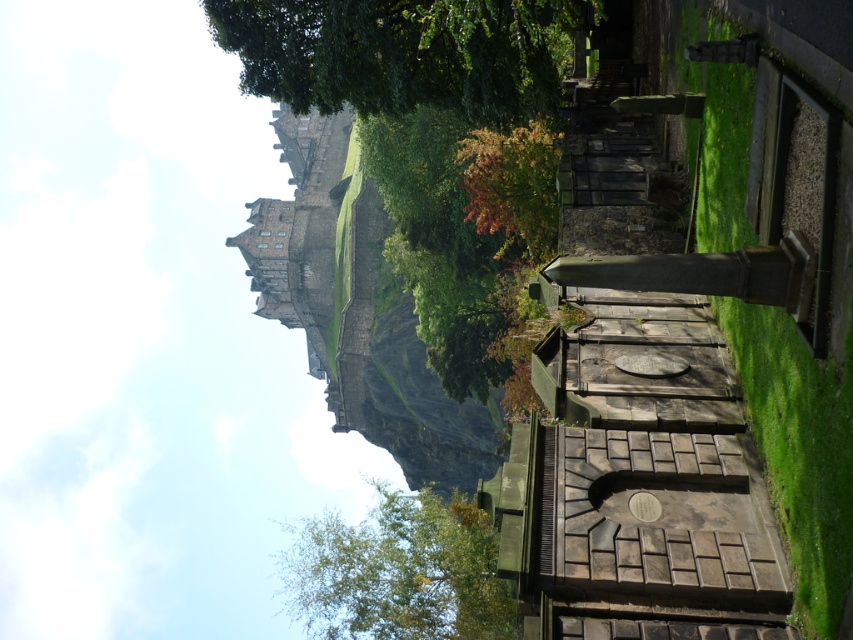
You are standing in the graveyard looking towards Edinburgh Castle. You notice two green leafy trees in the scene. Which tree, the green leafy tree at upper center or the green leafy tree at center, appears closer to you?

The green leafy tree at upper center is in front of the green leafy tree at center, so it appears closer to you.